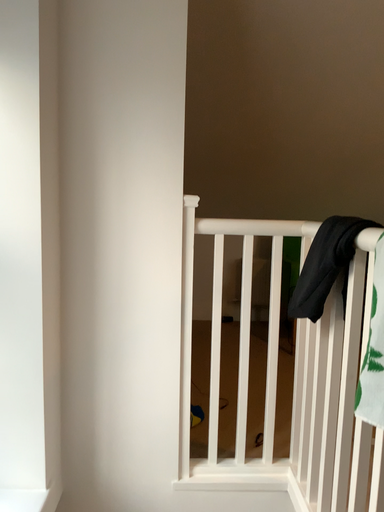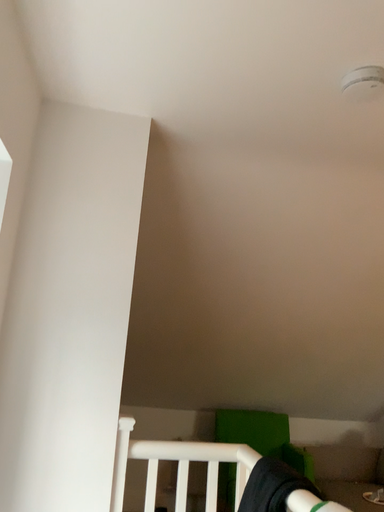
Question: How did the camera likely rotate when shooting the video?

Choices:
 (A) rotated upward
 (B) rotated downward

Answer: (A)